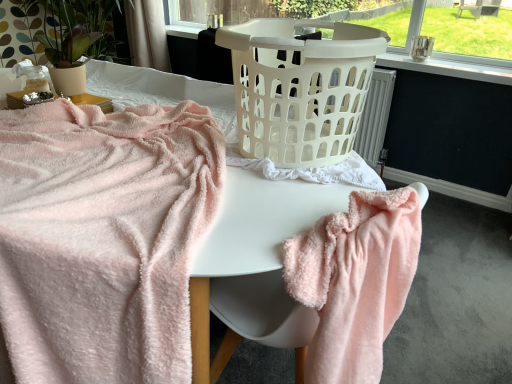
Question: Looking at the image, does white plastic laundry basket at center seem bigger or smaller compared to soft pink plush towel at left, acting as the 1th towel starting from the left?

Choices:
 (A) big
 (B) small

Answer: (B)

Question: From the image's perspective, is white plastic laundry basket at center located above or below soft pink plush towel at left, acting as the 1th towel starting from the left?

Choices:
 (A) above
 (B) below

Answer: (A)

Question: Which object is positioned farthest from the matte pink blanket at center?

Choices:
 (A) soft pink plush towel at left, acting as the 1th towel starting from the left
 (B) white sheer curtain at upper center
 (C) white plastic laundry basket at center
 (D) white plastic laundry basket at center
 (E) fluffy pink towel at lower right, placed as the second towel when sorted from left to right

Answer: (B)

Question: Estimate the real-world distances between objects in this image. Which object is farther from the matte beige pot at upper left?

Choices:
 (A) soft pink plush towel at left, arranged as the second towel when viewed from the right
 (B) white plastic laundry basket at upper center
 (C) white plastic laundry basket at center
 (D) white sheer curtain at upper center
 (E) white plastic laundry basket at center

Answer: (B)